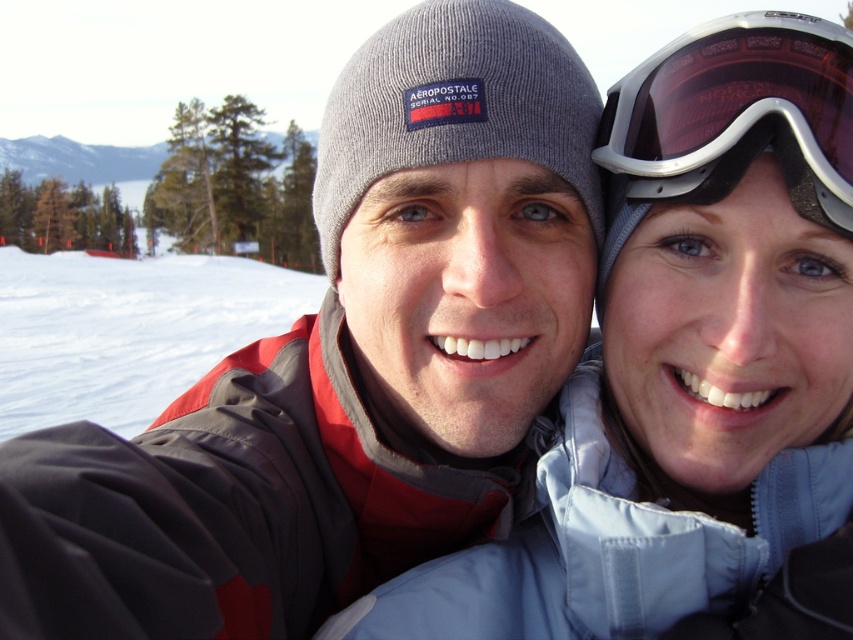
Based on the scene description, which object is positioned higher in the image, the white powder snow at lower left or the matte black goggles at upper right?

The matte black goggles at upper right are positioned higher in the image because the white powder snow at lower left is much taller than it.

You are a photographer trying to capture a wide shot of the scene. The white powder snow at lower left and the matte black goggles at upper right are in your frame. Based on their positions and sizes, which object would likely occupy more of the horizontal space in your photo?

The white powder snow at lower left might be wider than matte black goggles at upper right, so it would likely occupy more horizontal space in the photo.

You are standing at the camera position and want to take a photo of the two people. The white powder snow at lower left is in your way. Can you step back to avoid it?

The white powder snow at lower left is only 2.53 meters away from the camera, so stepping back a few steps should allow you to avoid it in the photo.